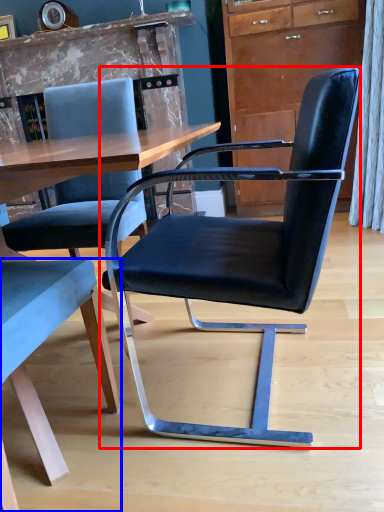
Question: Which point is further to the camera, chair (highlighted by a red box) or chair (highlighted by a blue box)?

Choices:
 (A) chair
 (B) chair

Answer: (A)